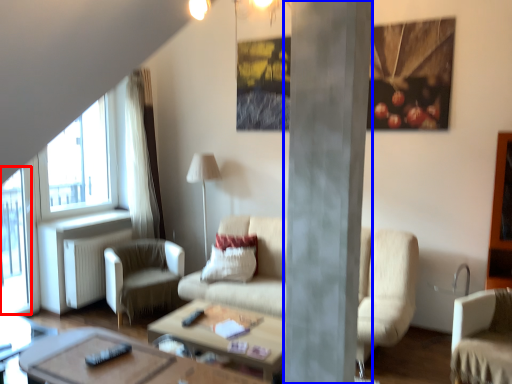
Question: Which object appears closest to the camera in this image, window screen (highlighted by a red box) or pillar (highlighted by a blue box)?

Choices:
 (A) window screen
 (B) pillar

Answer: (B)